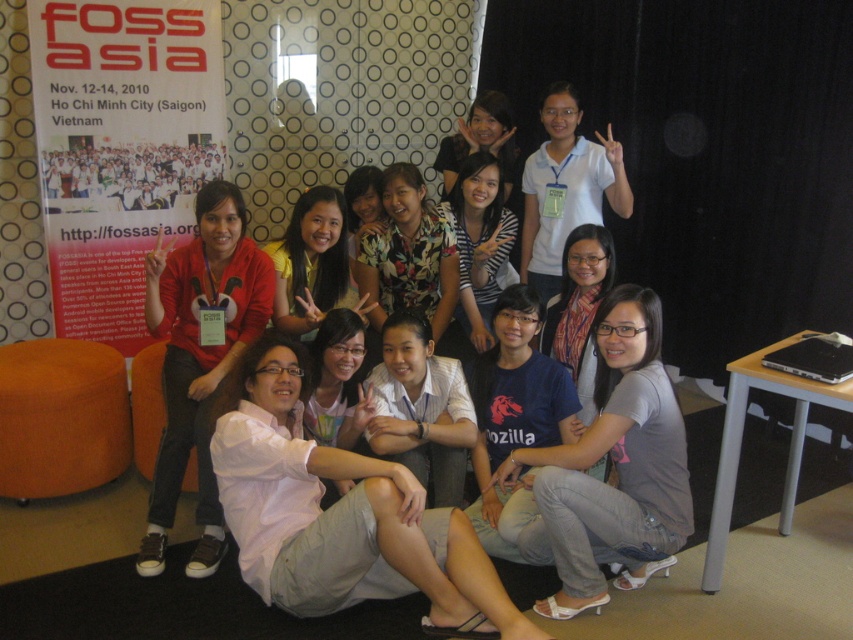
Is white paper poster at left taller than floral fabric shirt at center?

Yes, white paper poster at left is taller than floral fabric shirt at center.

Can you confirm if white paper poster at left is bigger than floral fabric shirt at center?

Yes, white paper poster at left is bigger than floral fabric shirt at center.

Find the location of `white paper poster at left`. white paper poster at left is located at coordinates (120, 147).

Measure the distance between white paper poster at left and striped shirt at center.

white paper poster at left and striped shirt at center are 4.43 feet apart.

Is point (152, 193) less distant than point (496, 243)?

No, it is behind (496, 243).

Identify the location of white paper poster at left. This screenshot has height=640, width=853. (120, 147).

Does pink cotton shirt at center appear on the left side of white cotton shirt at center?

Indeed, pink cotton shirt at center is positioned on the left side of white cotton shirt at center.

Is pink cotton shirt at center shorter than white cotton shirt at center?

In fact, pink cotton shirt at center may be taller than white cotton shirt at center.

Who is more forward, (282, 365) or (403, 328)?

Point (282, 365) is in front.

Find the location of a particular element. This screenshot has height=640, width=853. pink cotton shirt at center is located at coordinates (340, 513).